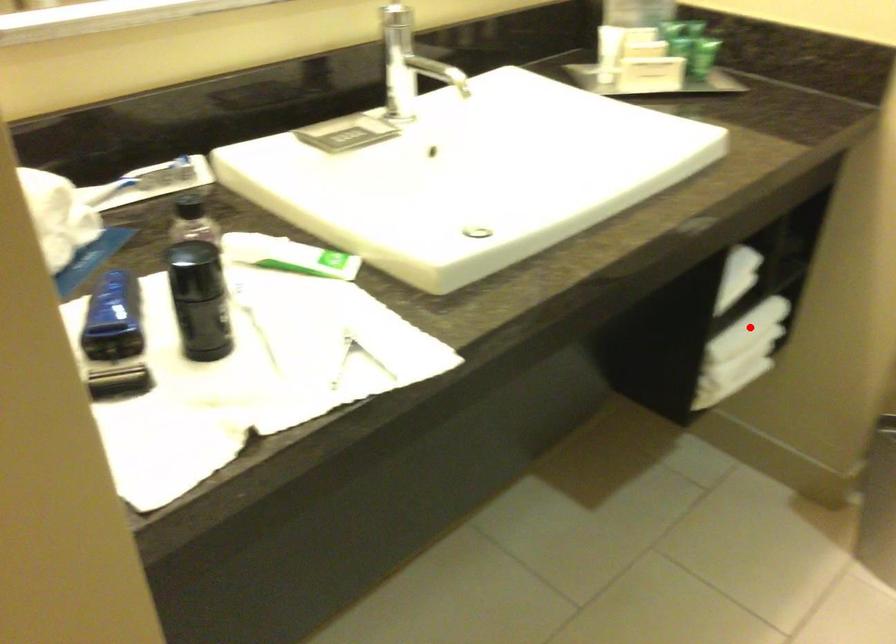
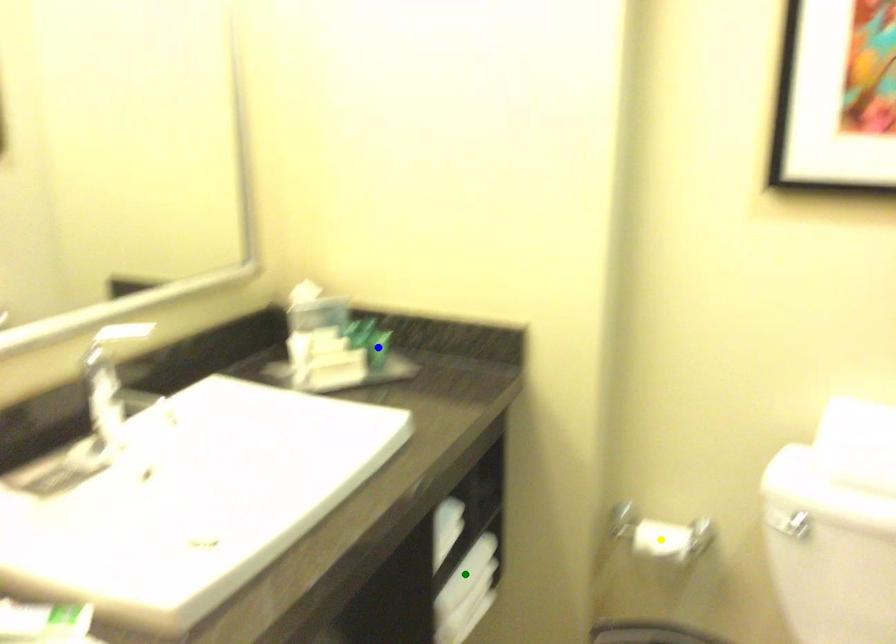
Question: I am providing you with two images of the same scene from different viewpoints. A red point is marked on the first image. You are given multiple points on the second image. Can you choose the point in image 2 that corresponds to the point in image 1?

Choices:
 (A) blue point
 (B) green point
 (C) yellow point

Answer: (B)